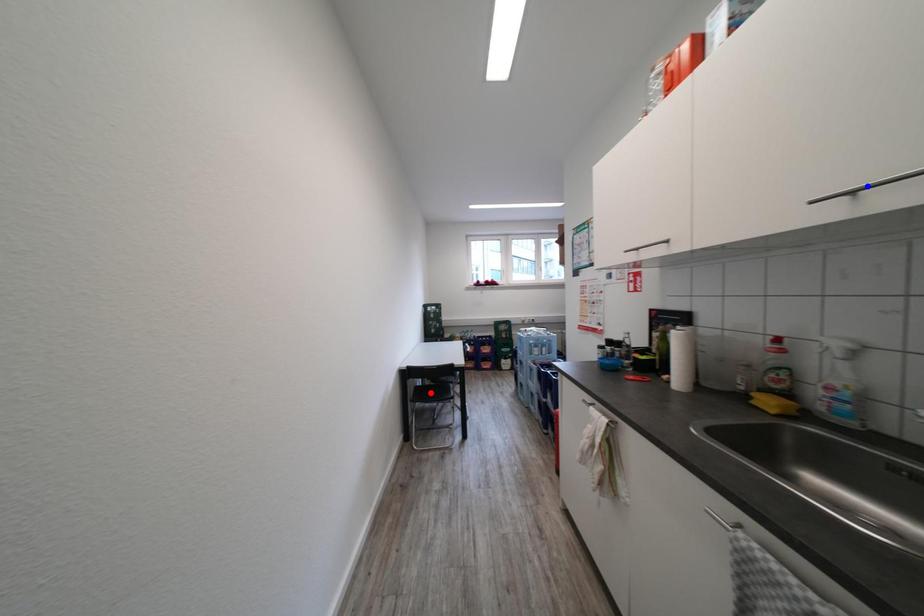
Question: Two points are marked on the image. Which point is closer to the camera?

Choices:
 (A) Blue point is closer.
 (B) Red point is closer.

Answer: (A)